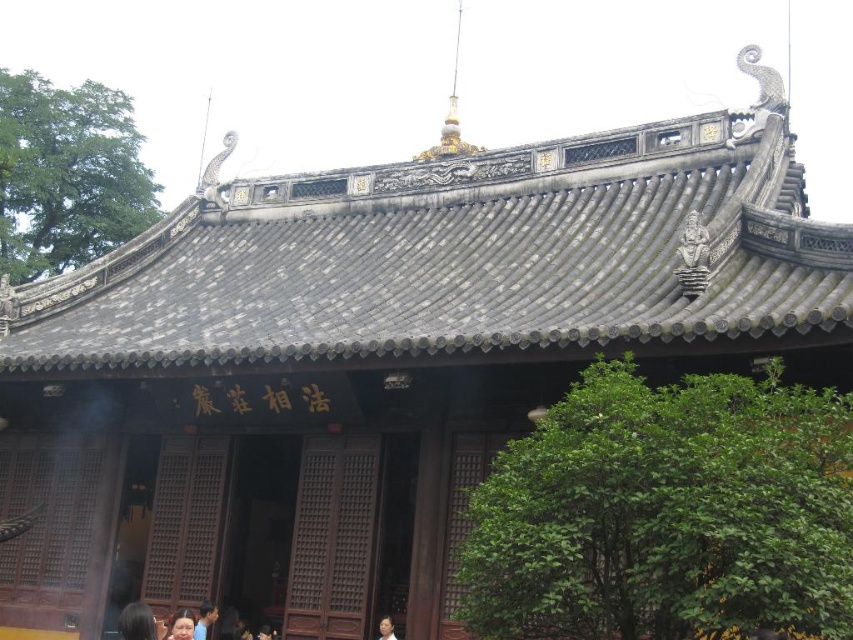
Question: Which object is farther from the camera taking this photo?

Choices:
 (A) blue shirt at lower center
 (B) smooth brown hair at lower center

Answer: (A)

Question: Does blue shirt at lower center appear on the right side of smooth brown hair at lower center?

Choices:
 (A) yes
 (B) no

Answer: (B)

Question: Among these objects, which one is nearest to the camera?

Choices:
 (A) blue shirt at lower center
 (B) smooth skin face at lower center

Answer: (B)

Question: Considering the real-world distances, which object is closest to the smooth skin face at lower center?

Choices:
 (A) blue shirt at lower center
 (B) smooth brown hair at lower center

Answer: (A)

Question: Can you confirm if smooth skin face at lower center is smaller than smooth brown hair at lower center?

Choices:
 (A) yes
 (B) no

Answer: (B)

Question: Does blue shirt at lower center appear under smooth skin face at lower center?

Choices:
 (A) yes
 (B) no

Answer: (A)